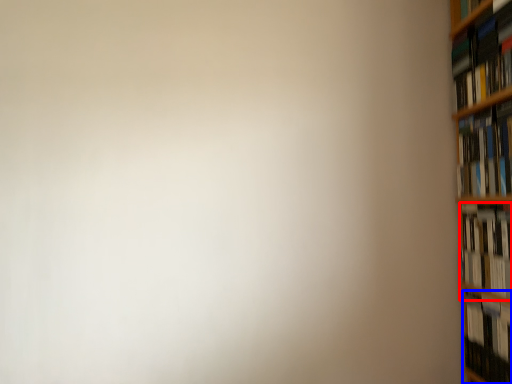
Question: Which of the following is the closest to the observer, book (highlighted by a red box) or book (highlighted by a blue box)?

Choices:
 (A) book
 (B) book

Answer: (A)